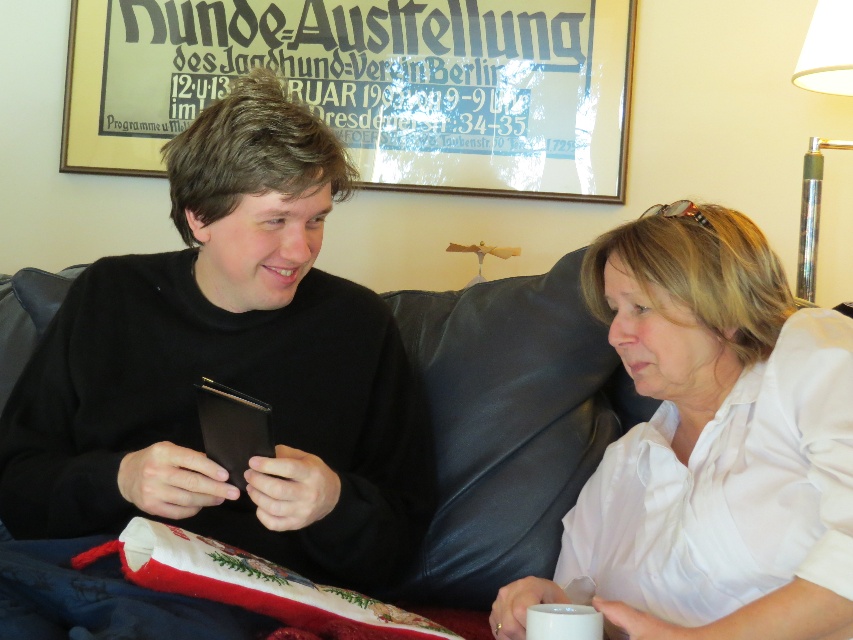
In the scene shown: Between black matte wallet at left and white cotton shirt at upper right, which one appears on the right side from the viewer's perspective?

Positioned to the right is white cotton shirt at upper right.

Can you confirm if black matte wallet at left is wider than white cotton shirt at upper right?

Yes, black matte wallet at left is wider than white cotton shirt at upper right.

At what (x,y) coordinates should I click in order to perform the action: click on black matte wallet at left. Please return your answer as a coordinate pair (x, y). Looking at the image, I should click on (228, 368).